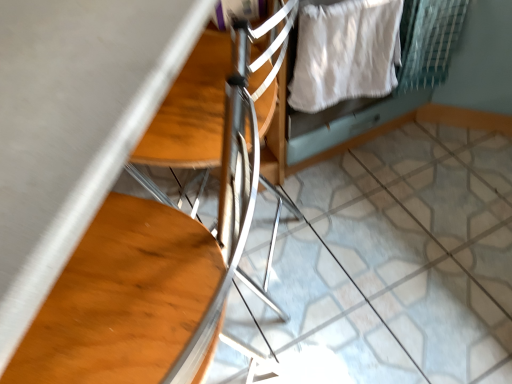
What is the approximate height of white cotton sheet at upper right?

white cotton sheet at upper right is 14.45 inches tall.

Identify the location of white cotton sheet at upper right. (345, 52).

What do you see at coordinates (345, 52) in the screenshot? Image resolution: width=512 pixels, height=384 pixels. I see `white cotton sheet at upper right` at bounding box center [345, 52].

The image size is (512, 384). I want to click on white cotton sheet at upper right, so click(x=345, y=52).